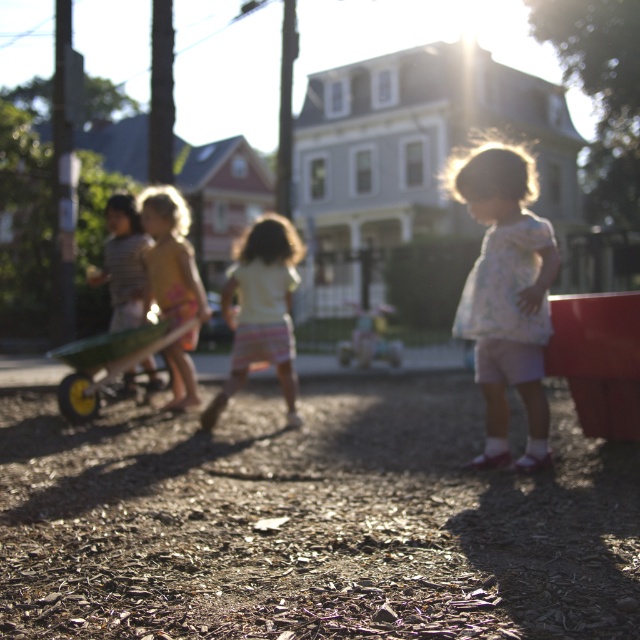
Does white floral dress at right have a lesser height compared to yellow cotton shirt at center?

No, white floral dress at right is not shorter than yellow cotton shirt at center.

Does white floral dress at right appear on the left side of yellow cotton shirt at center?

No, white floral dress at right is not to the left of yellow cotton shirt at center.

I want to click on white floral dress at right, so click(x=506, y=292).

This screenshot has width=640, height=640. In order to click on white floral dress at right in this screenshot , I will do `click(506, 292)`.

Between point (544, 228) and point (280, 240), which one is positioned behind?

The point (280, 240) is more distant.

Which is below, white floral dress at right or pastel striped shorts at center?

pastel striped shorts at center is lower down.

Where is `white floral dress at right`? white floral dress at right is located at coordinates 506,292.

This screenshot has width=640, height=640. Identify the location of white floral dress at right. (506, 292).

Which is behind, point (192, 288) or point (113, 225)?

The point (113, 225) is more distant.

Find the location of a particular element. yellow cotton shirt at center is located at coordinates (172, 256).